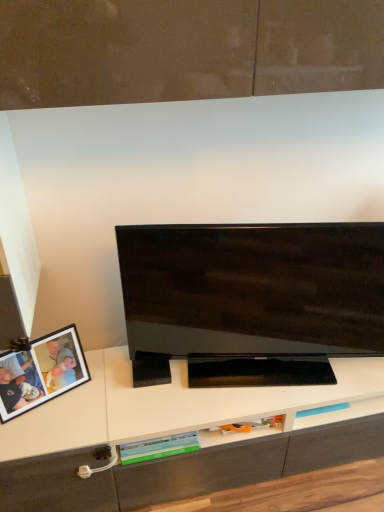
Describe the element at coordinates (250, 291) in the screenshot. I see `glossy black tv at center` at that location.

Identify the location of glossy black tv at center. The image size is (384, 512). (250, 291).

The width and height of the screenshot is (384, 512). What do you see at coordinates (41, 372) in the screenshot?
I see `matte black photo frame at lower left` at bounding box center [41, 372].

This screenshot has width=384, height=512. I want to click on matte black photo frame at lower left, so click(41, 372).

Where is `glossy black tv at center`? This screenshot has height=512, width=384. glossy black tv at center is located at coordinates (250, 291).

In the image, is glossy black tv at center on the left side or the right side of matte black photo frame at lower left?

glossy black tv at center is to the right of matte black photo frame at lower left.

Relative to matte black photo frame at lower left, is glossy black tv at center in front or behind?

In the image, glossy black tv at center appears in front of matte black photo frame at lower left.

Does point (174, 323) come behind point (47, 335)?

No, it is not.

From the image's perspective, which one is positioned higher, glossy black tv at center or matte black photo frame at lower left?

glossy black tv at center is shown above in the image.

From a real-world perspective, which is physically above, glossy black tv at center or matte black photo frame at lower left?

In real-world perspective, glossy black tv at center is above.

Does glossy black tv at center have a lesser width compared to matte black photo frame at lower left?

No.

Who is shorter, glossy black tv at center or matte black photo frame at lower left?

matte black photo frame at lower left.

In the scene shown: Considering the sizes of objects glossy black tv at center and matte black photo frame at lower left in the image provided, who is smaller, glossy black tv at center or matte black photo frame at lower left?

Smaller between the two is matte black photo frame at lower left.

Is glossy black tv at center positioned beyond the bounds of matte black photo frame at lower left?

Yes, glossy black tv at center is located beyond the bounds of matte black photo frame at lower left.

Is glossy black tv at center far away from matte black photo frame at lower left?

glossy black tv at center is actually quite close to matte black photo frame at lower left.

Is glossy black tv at center oriented towards matte black photo frame at lower left?

No, glossy black tv at center is not turned towards matte black photo frame at lower left.

The width and height of the screenshot is (384, 512). Find the location of `television above the matte black photo frame at lower left (from a real-world perspective)`. television above the matte black photo frame at lower left (from a real-world perspective) is located at coordinates (250, 291).

Which is more to the right, matte black photo frame at lower left or glossy black tv at center?

From the viewer's perspective, glossy black tv at center appears more on the right side.

Is matte black photo frame at lower left closer to the viewer compared to glossy black tv at center?

No.

Which is further, [23,354] or [170,337]?

The point [170,337] is more distant.

From the image's perspective, is matte black photo frame at lower left positioned above or below glossy black tv at center?

matte black photo frame at lower left is below glossy black tv at center.

From a real-world perspective, between matte black photo frame at lower left and glossy black tv at center, who is vertically higher?

glossy black tv at center is physically above.

Which of these two, matte black photo frame at lower left or glossy black tv at center, is thinner?

matte black photo frame at lower left is thinner.

Is matte black photo frame at lower left taller or shorter than glossy black tv at center?

Considering their sizes, matte black photo frame at lower left has less height than glossy black tv at center.

Considering the relative sizes of matte black photo frame at lower left and glossy black tv at center in the image provided, is matte black photo frame at lower left smaller than glossy black tv at center?

Indeed, matte black photo frame at lower left has a smaller size compared to glossy black tv at center.

Is matte black photo frame at lower left positioned beyond the bounds of glossy black tv at center?

matte black photo frame at lower left lies outside glossy black tv at center's area.

Is matte black photo frame at lower left next to glossy black tv at center?

There is a gap between matte black photo frame at lower left and glossy black tv at center.

In the scene shown: Is matte black photo frame at lower left oriented towards glossy black tv at center?

No, matte black photo frame at lower left is not facing towards glossy black tv at center.

The image size is (384, 512). What are the coordinates of `picture frame that is under the glossy black tv at center (from a real-world perspective)` in the screenshot? It's located at (41, 372).

This screenshot has width=384, height=512. I want to click on picture frame behind the glossy black tv at center, so click(41, 372).

Where is `television lying in front of the matte black photo frame at lower left`? This screenshot has height=512, width=384. television lying in front of the matte black photo frame at lower left is located at coordinates (250, 291).